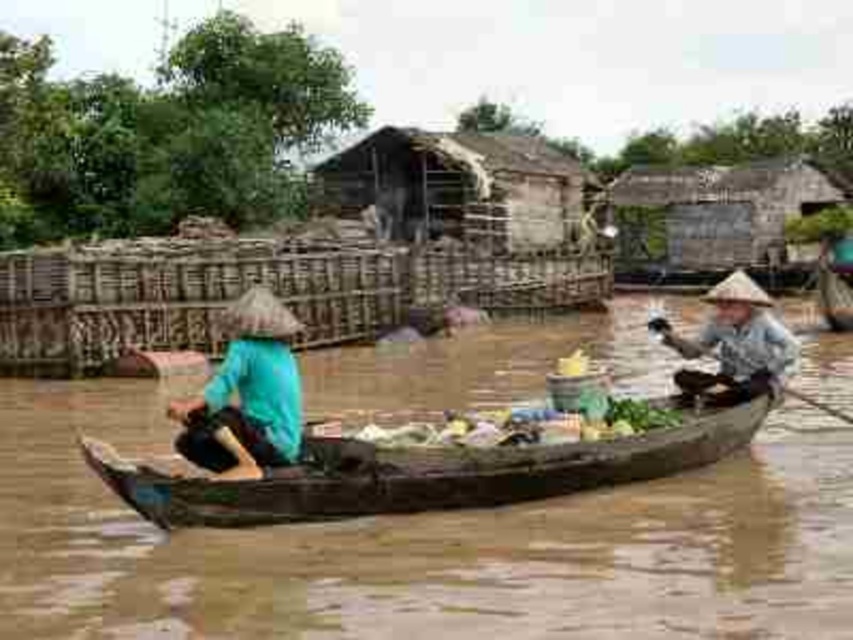
You are a vendor at the floating market and want to place both the teal fabric hat at left and the matte brown hat at right on your display stand. If the stand can only hold one hat at a time, which hat should you display first to ensure it fits properly?

The teal fabric hat at left is smaller than the matte brown hat at right, so you should display the teal fabric hat at left first to ensure it fits properly before placing the larger matte brown hat at right.

You are standing at the edge of the water in the floating market scene. There is a wooden canoe at center and a point marked at coordinate [419,472]. Where is the point located?

The point at [419,472] is located on the wooden canoe at center.